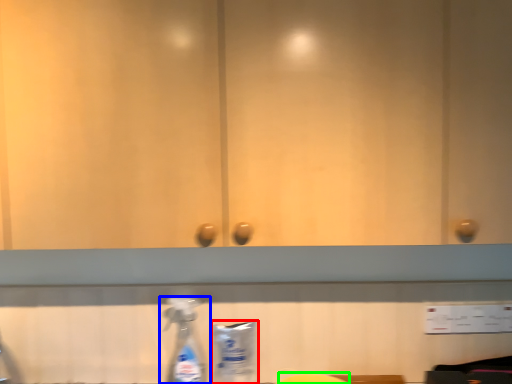
Question: Estimate the real-world distances between objects in this image. Which object is farther from cleaning product (highlighted by a red box), bottle (highlighted by a blue box) or wide (highlighted by a green box)?

Choices:
 (A) bottle
 (B) wide

Answer: (B)